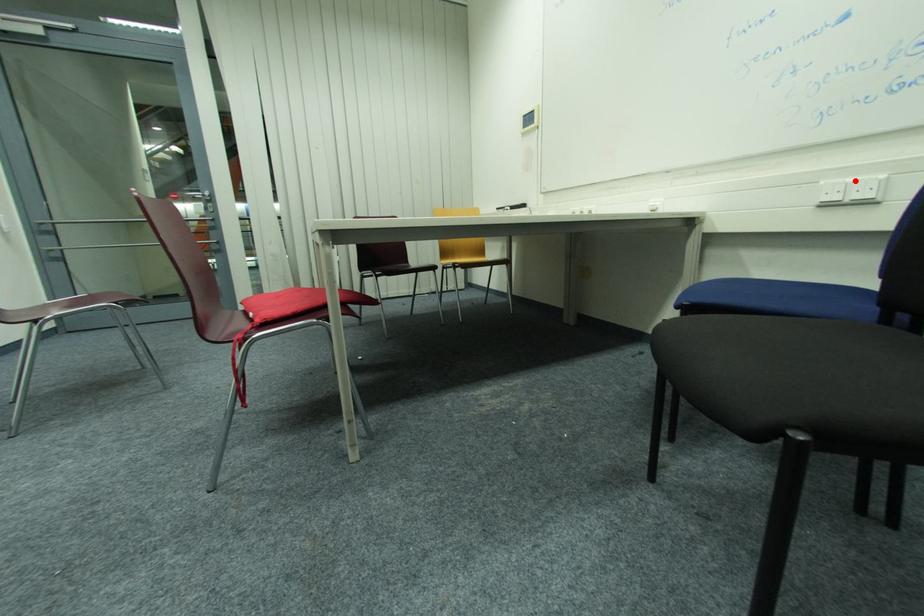
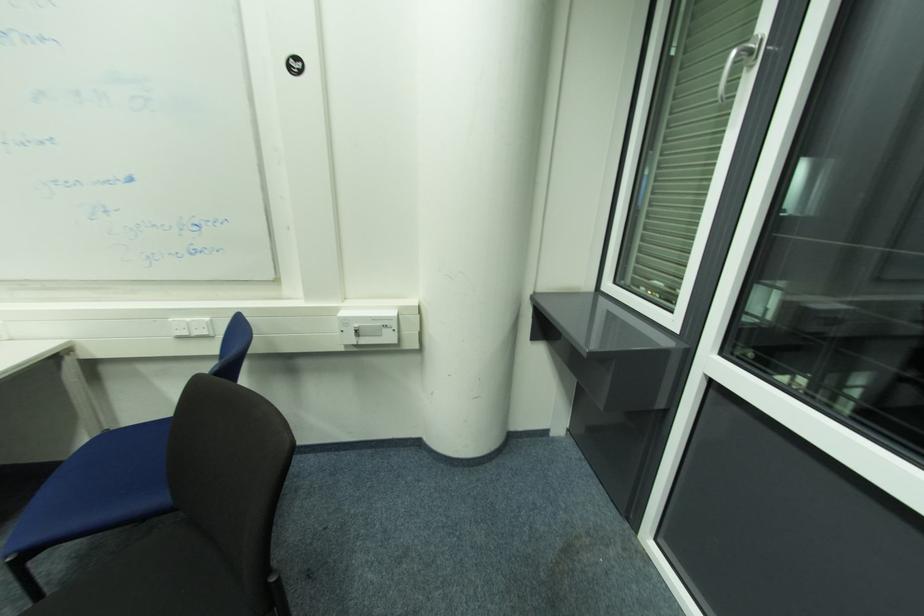
In the second image, find the point that corresponds to the highlighted location in the first image.

(191, 320)